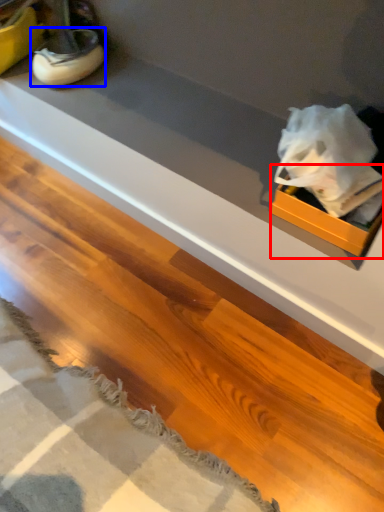
Question: Which object appears closest to the camera in this image, box (highlighted by a red box) or footwear (highlighted by a blue box)?

Choices:
 (A) box
 (B) footwear

Answer: (A)